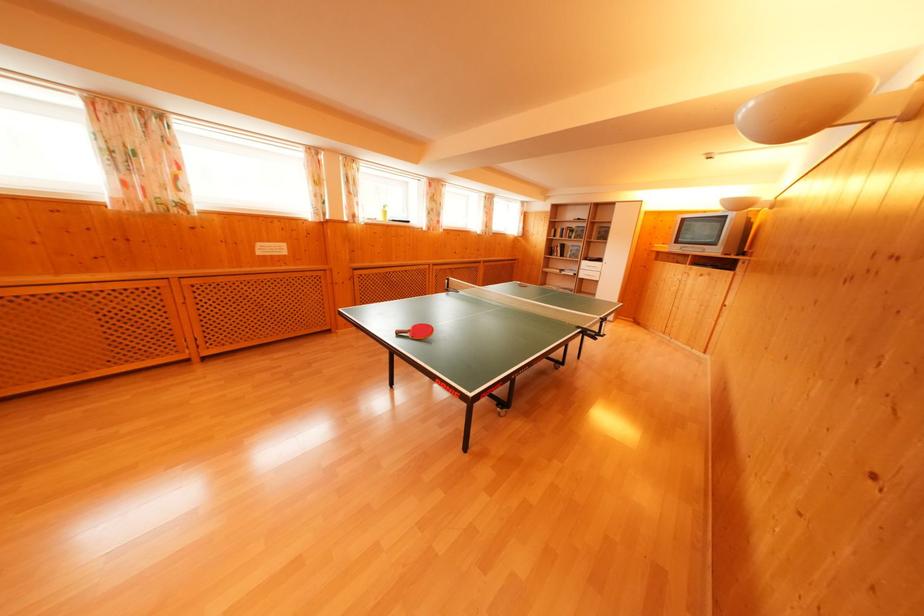
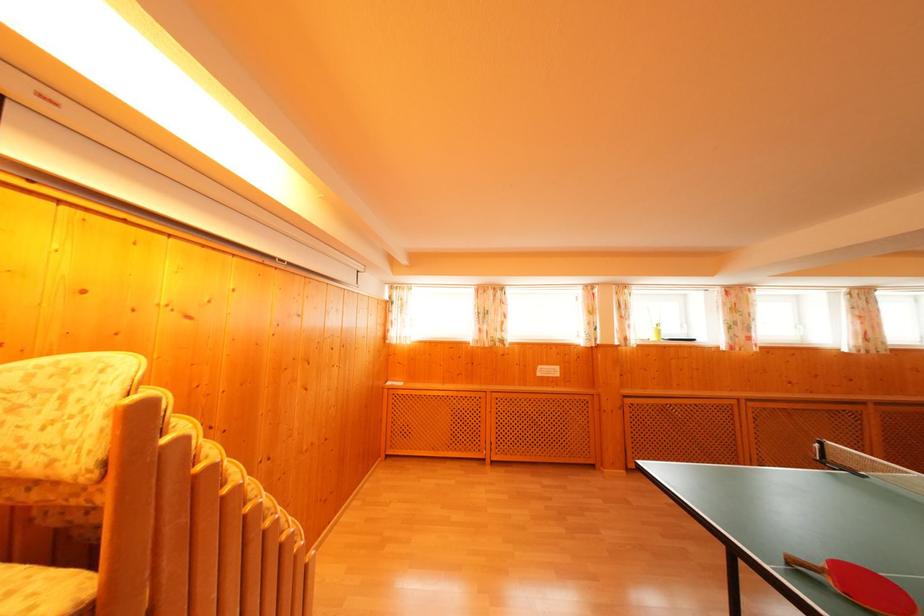
In the second image, find the point that corresponds to point 426,338 in the first image.

(870, 594)